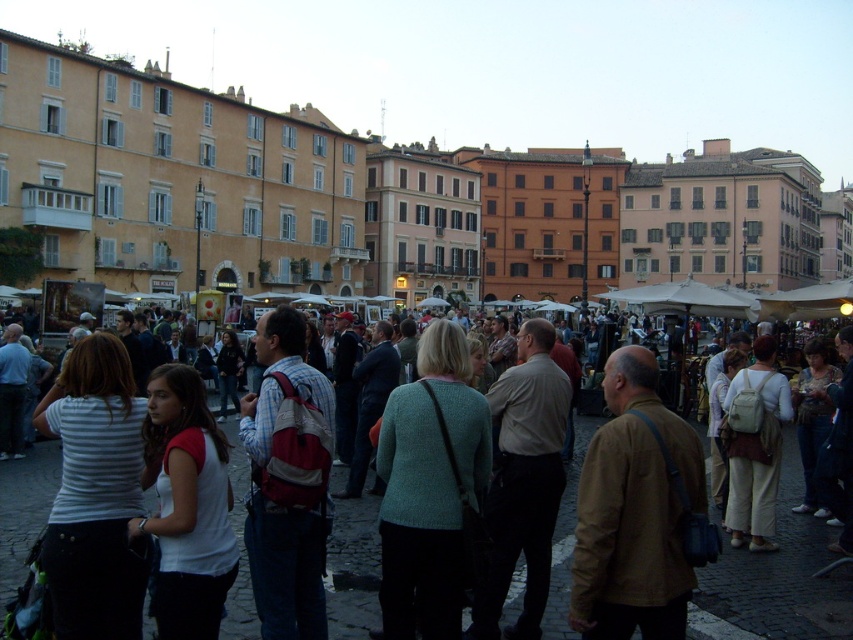
Question: Where is beige stone buildings at upper left located in relation to matte white shirt at center in the image?

Choices:
 (A) right
 (B) left

Answer: (A)

Question: Which point is farther from the camera taking this photo?

Choices:
 (A) (16, 544)
 (B) (291, 148)

Answer: (B)

Question: Does beige stone buildings at upper left come behind matte white shirt at center?

Choices:
 (A) yes
 (B) no

Answer: (A)

Question: Is beige stone buildings at upper left behind matte white shirt at center?

Choices:
 (A) yes
 (B) no

Answer: (A)